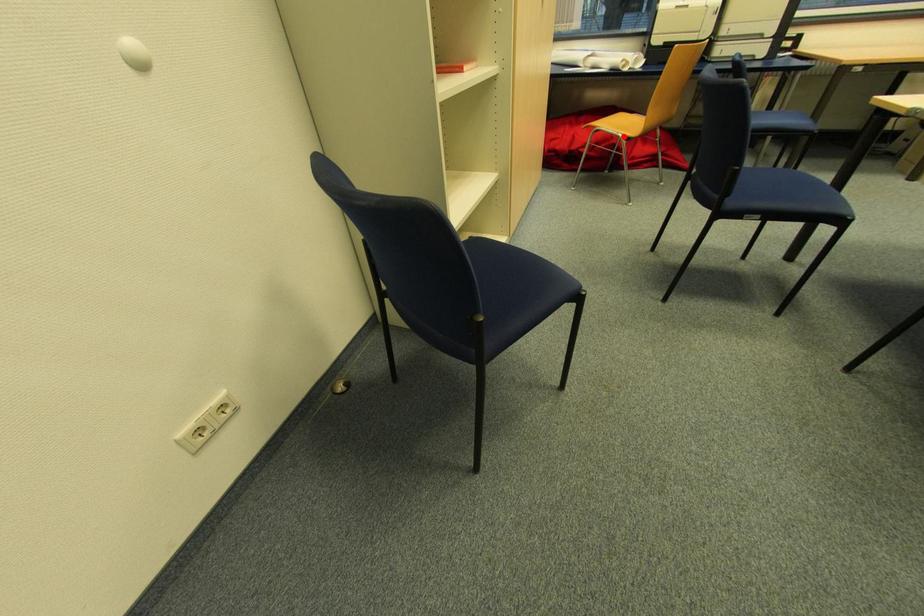
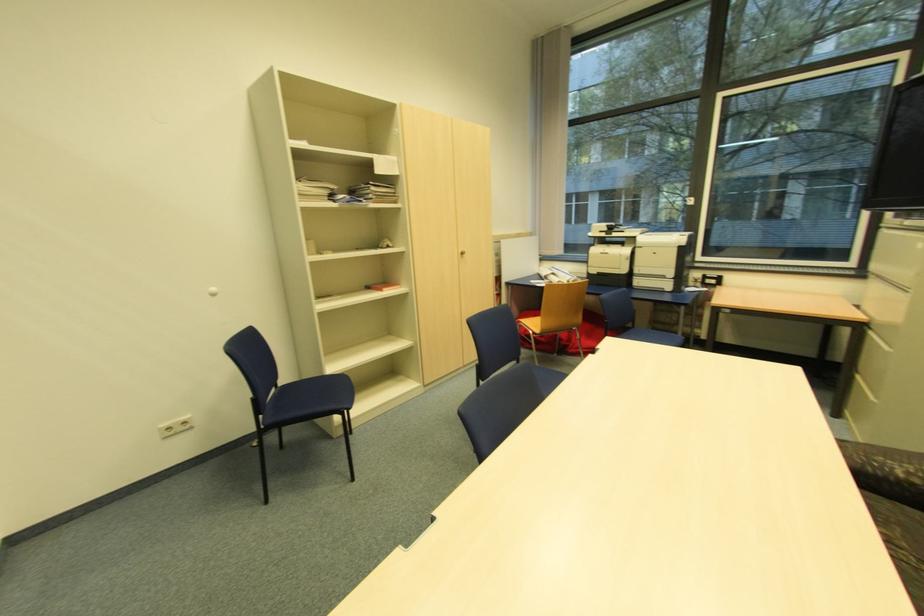
Question: A red point is marked in image1. In image2, is the corresponding 3D point closer to the camera or farther? Reply with the corresponding letter.

Choices:
 (A) The corresponding 3D point is closer.
 (B) The corresponding 3D point is farther.

Answer: (B)